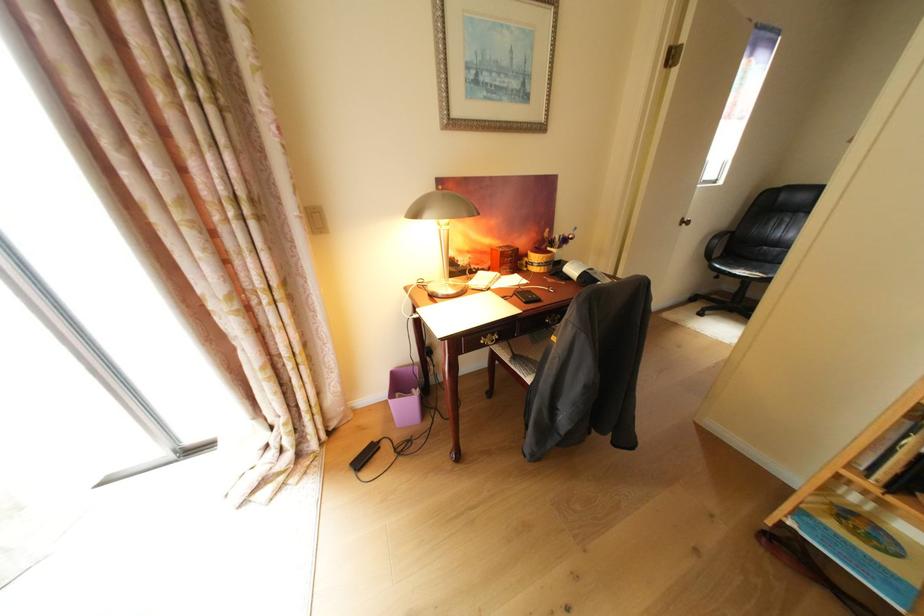
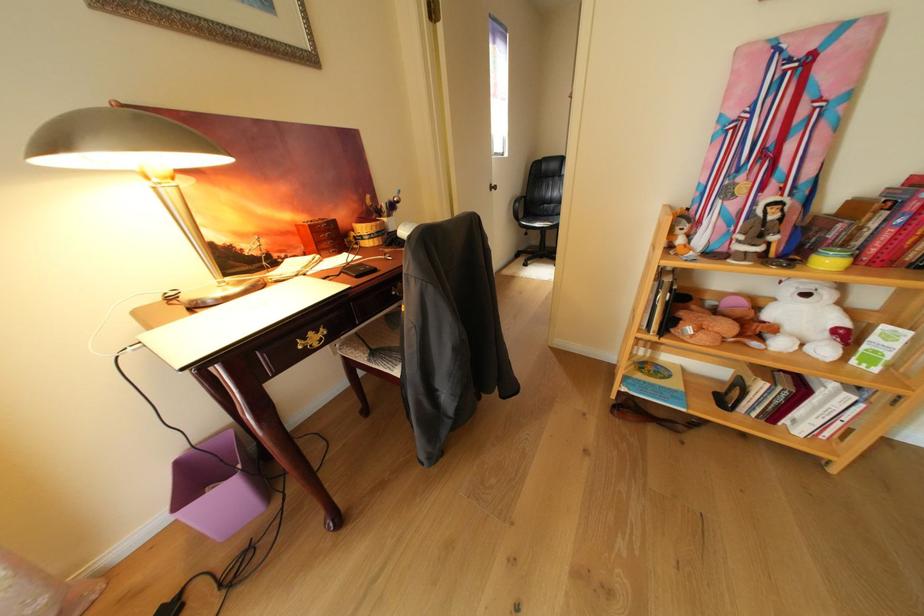
Where in the second image is the point corresponding to pixel 494 344 from the first image?

(312, 349)